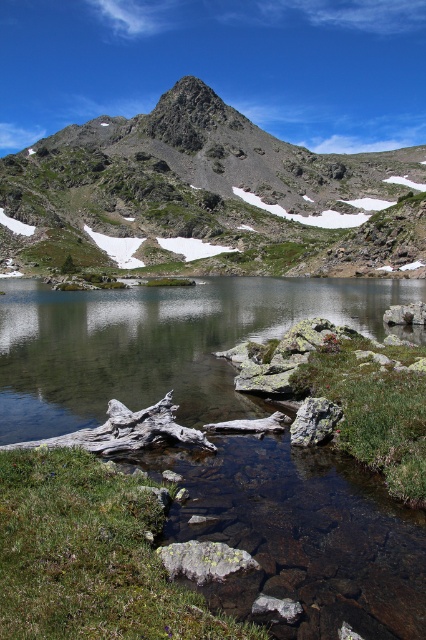
You are a hiker who wants to cross the stream without getting your boots wet. The smooth rock stream at center and the gray rough rock at lower center are both in your path. Which one can you step on to avoid getting wet?

The gray rough rock at lower center is narrower than the smooth rock stream at center, so stepping on the gray rough rock at lower center would be safer to avoid getting wet since it is smaller and less likely to be submerged in the water.

You are standing at the origin point of the coordinate system in the image, which is the bottom left corner. You want to place a small flag exactly at the location of the gray rock at lower center. What are the coordinates where you should place the flag?

The coordinates for placing the flag at the gray rock at lower center are 0.877 on the x axis and 0.481 on the y axis.

You are standing at the edge of the alpine lake and see two points marked in the image. Which point is closer to you, point (x=106, y=332) or point (x=391, y=314)?

Point (x=106, y=332) is closer to you because it is further to the viewer than point (x=391, y=314).